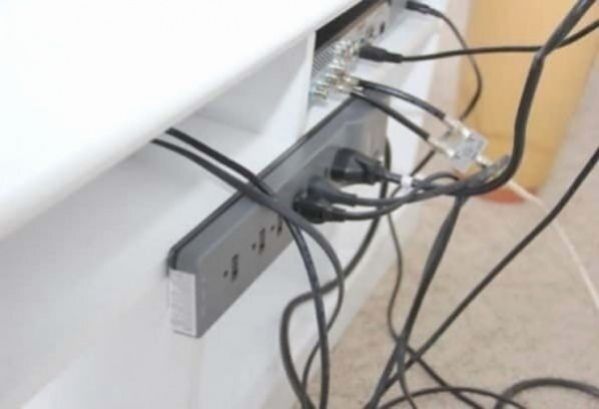
Identify the location of cord. (223, 157), (223, 174), (337, 213), (350, 195), (372, 169), (396, 109), (404, 93), (410, 50), (450, 23).